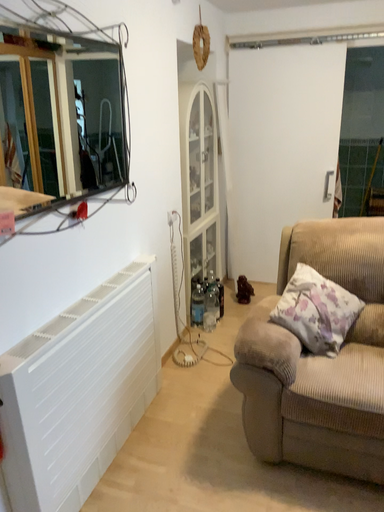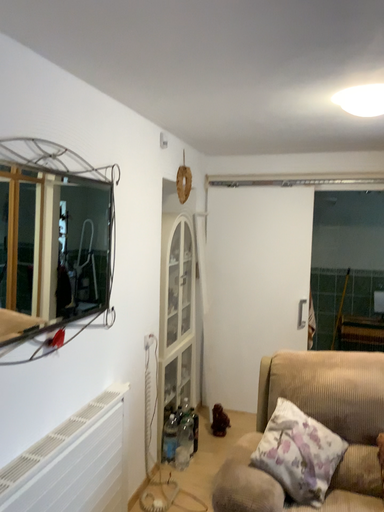
Question: Which way did the camera rotate in the video?

Choices:
 (A) rotated upward
 (B) rotated downward

Answer: (A)